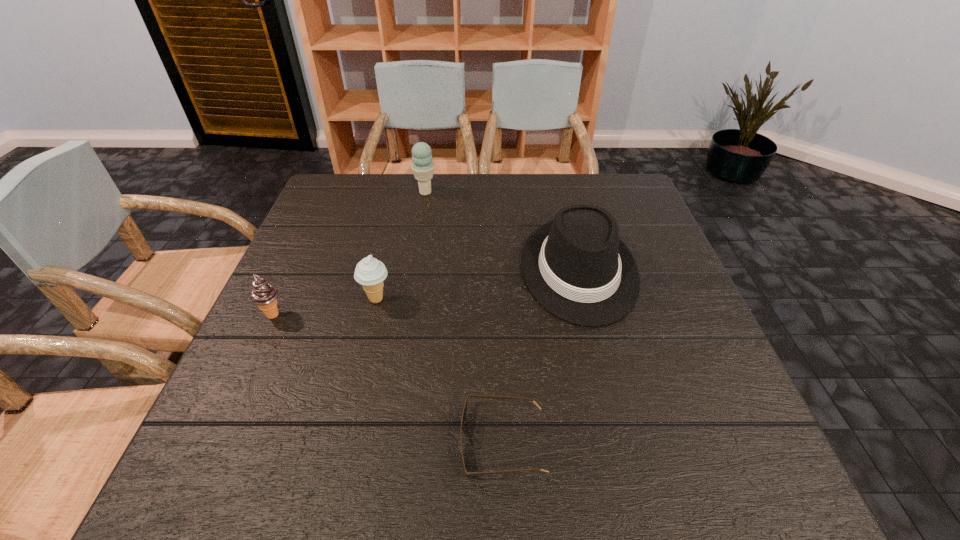
You are a GUI agent. You are given a task and a screenshot of the screen. Output one action in this format:
    pyautogui.click(x=<x>, y=<y>)
    Task: Click on the blank space located on the right of the leftmost object
    This screenshot has width=960, height=540.
    Given the screenshot: What is the action you would take?
    pyautogui.click(x=339, y=314)

Where is `free location located on the lenses of the nearest object`? The width and height of the screenshot is (960, 540). free location located on the lenses of the nearest object is located at coordinates (385, 443).

Where is `vacant space located 0.200m on the lenses of the nearest object`? Image resolution: width=960 pixels, height=540 pixels. vacant space located 0.200m on the lenses of the nearest object is located at coordinates (345, 443).

Where is `free space located on the lenses of the nearest object`? Image resolution: width=960 pixels, height=540 pixels. free space located on the lenses of the nearest object is located at coordinates (235, 443).

Locate an element on the screen. This screenshot has height=540, width=960. object present at the far edge is located at coordinates tap(422, 167).

What are the coordinates of `object positioned at the near edge` in the screenshot? It's located at (464, 412).

Image resolution: width=960 pixels, height=540 pixels. I want to click on object situated at the left edge, so click(x=264, y=295).

Locate an element on the screen. The height and width of the screenshot is (540, 960). object present at the right edge is located at coordinates (576, 266).

What are the coordinates of `free space at the far edge of the desktop` in the screenshot? It's located at (518, 190).

Where is `free region at the near edge of the desktop`? The height and width of the screenshot is (540, 960). free region at the near edge of the desktop is located at coordinates (578, 455).